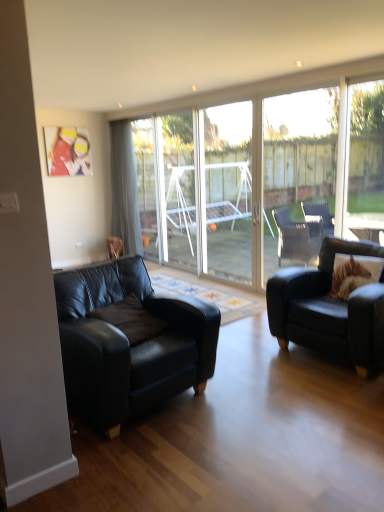
Find the location of `transparent glass door at center, which appears as the second window when viewed from the left`. transparent glass door at center, which appears as the second window when viewed from the left is located at coordinates (297, 172).

What do you see at coordinates (329, 309) in the screenshot?
I see `matte black armchair at right, which ranks as the 2th studio couch in left-to-right order` at bounding box center [329, 309].

This screenshot has width=384, height=512. What are the coordinates of `transparent glass screen door at center` in the screenshot? It's located at (213, 192).

The height and width of the screenshot is (512, 384). Describe the element at coordinates (354, 273) in the screenshot. I see `brown textured pillow at right` at that location.

Find the location of a particular element. The width and height of the screenshot is (384, 512). brown textured pillow at right is located at coordinates (354, 273).

Find the location of `transparent glass door at center, which is the first window from right to left`. transparent glass door at center, which is the first window from right to left is located at coordinates (297, 172).

From a real-world perspective, which is physically above, matte black armchair at right, which ranks as the 2th studio couch in left-to-right order, or transparent glass screen door at center?

transparent glass screen door at center is physically above.

Considering the relative sizes of matte black armchair at right, the 1th studio couch viewed from the right, and transparent glass screen door at center in the image provided, is matte black armchair at right, the 1th studio couch viewed from the right, shorter than transparent glass screen door at center?

Yes.

Looking at this image, which is correct: matte black armchair at right, the 1th studio couch viewed from the right, is inside transparent glass screen door at center, or outside of it?

matte black armchair at right, the 1th studio couch viewed from the right, is outside transparent glass screen door at center.

From the image's perspective, is matte black armchair at right, which ranks as the 2th studio couch in left-to-right order, above transparent glass screen door at center?

Actually, matte black armchair at right, which ranks as the 2th studio couch in left-to-right order, appears below transparent glass screen door at center in the image.

Which object is positioned more to the left, black leather couch at left, which appears as the second studio couch when viewed from the right, or transparent glass window at center, arranged as the first window when viewed from the back?

transparent glass window at center, arranged as the first window when viewed from the back, is more to the left.

Could you tell me if black leather couch at left, which is counted as the 1th studio couch, starting from the left, is turned towards transparent glass window at center, which is the 2th window from right to left?

No, black leather couch at left, which is counted as the 1th studio couch, starting from the left, is not facing towards transparent glass window at center, which is the 2th window from right to left.

Is black leather couch at left, which is counted as the 1th studio couch, starting from the left, far away from transparent glass window at center, which is the 2th window from right to left?

Yes, black leather couch at left, which is counted as the 1th studio couch, starting from the left, and transparent glass window at center, which is the 2th window from right to left, are quite far apart.

Image resolution: width=384 pixels, height=512 pixels. I want to click on the 1st studio couch counting from the right side of the transparent glass window at center, which is the 2th window from right to left, so click(129, 342).

Is point (152, 142) closer or farther from the camera than point (214, 172)?

Point (152, 142).

Can you tell me how much transparent glass window at center, which is counted as the 2th window, starting from the front, and transparent glass screen door at center differ in facing direction?

There is a 0.00215-degree angle between the facing directions of transparent glass window at center, which is counted as the 2th window, starting from the front, and transparent glass screen door at center.

From a real-world perspective, is transparent glass window at center, arranged as the first window when viewed from the back, above or below transparent glass screen door at center?

From a real-world perspective, transparent glass window at center, arranged as the first window when viewed from the back, is physically below transparent glass screen door at center.

Does transparent glass window at center, which is counted as the 2th window, starting from the front, appear on the right side of transparent glass screen door at center?

No, transparent glass window at center, which is counted as the 2th window, starting from the front, is not to the right of transparent glass screen door at center.

Is the surface of transparent glass screen door at center in direct contact with transparent glass window at center, placed as the 1th window when sorted from left to right?

transparent glass screen door at center is not next to transparent glass window at center, placed as the 1th window when sorted from left to right, and they're not touching.

Considering the sizes of transparent glass screen door at center and transparent glass window at center, which is counted as the 2th window, starting from the front, in the image, is transparent glass screen door at center bigger or smaller than transparent glass window at center, which is counted as the 2th window, starting from the front,?

Clearly, transparent glass screen door at center is larger in size than transparent glass window at center, which is counted as the 2th window, starting from the front.

Is transparent glass screen door at center spatially inside transparent glass window at center, arranged as the first window when viewed from the back, or outside of it?

transparent glass screen door at center is not inside transparent glass window at center, arranged as the first window when viewed from the back, it's outside.

How far apart are transparent glass window at center, which is the 2th window from right to left, and transparent glass door at center, the 1th window positioned from the front?

transparent glass window at center, which is the 2th window from right to left, and transparent glass door at center, the 1th window positioned from the front, are 6.29 feet apart from each other.

Is transparent glass window at center, which is the 2th window from right to left, wider or thinner than transparent glass door at center, the second window when ordered from back to front?

Considering their sizes, transparent glass window at center, which is the 2th window from right to left, looks slimmer than transparent glass door at center, the second window when ordered from back to front.

Does transparent glass window at center, which is the 2th window from right to left, appear on the left side of transparent glass door at center, the second window when ordered from back to front?

Indeed, transparent glass window at center, which is the 2th window from right to left, is positioned on the left side of transparent glass door at center, the second window when ordered from back to front.

Between gray fabric curtain at left and brown textured pillow at right, which one is positioned behind?

Positioned behind is gray fabric curtain at left.

From the picture: From a real-world perspective, is gray fabric curtain at left physically above brown textured pillow at right?

Yes.

Considering the sizes of gray fabric curtain at left and brown textured pillow at right in the image, is gray fabric curtain at left taller or shorter than brown textured pillow at right?

Considering their sizes, gray fabric curtain at left has more height than brown textured pillow at right.

Between gray fabric curtain at left and brown textured pillow at right, which one has smaller width?

brown textured pillow at right is thinner.

Who is smaller, transparent glass door at center or black leather couch at left, which appears as the second studio couch when viewed from the right?

transparent glass door at center is smaller.

From a real-world perspective, who is located higher, transparent glass door at center or black leather couch at left, which appears as the second studio couch when viewed from the right?

In real-world perspective, transparent glass door at center is above.

Where is `glass door on the right of the black leather couch at left, which appears as the second studio couch when viewed from the right`? This screenshot has width=384, height=512. glass door on the right of the black leather couch at left, which appears as the second studio couch when viewed from the right is located at coordinates (177, 189).

Is transparent glass door at center to the right of black leather couch at left, which is counted as the 1th studio couch, starting from the left, from the viewer's perspective?

Indeed, transparent glass door at center is positioned on the right side of black leather couch at left, which is counted as the 1th studio couch, starting from the left.

Where is `screen door on the left of matte black armchair at right, which ranks as the 2th studio couch in left-to-right order`? This screenshot has height=512, width=384. screen door on the left of matte black armchair at right, which ranks as the 2th studio couch in left-to-right order is located at coordinates (213, 192).

Starting from the transparent glass window at center, placed as the 1th window when sorted from left to right, which studio couch is the 2nd one in front? Please provide its 2D coordinates.

[(129, 342)]

In the scene shown: Estimate the real-world distances between objects in this image. Which object is closer to transparent glass screen door at center, transparent glass door at center, which is the first window from right to left, or transparent glass window at center, which is the 2th window from right to left?

The object closer to transparent glass screen door at center is transparent glass door at center, which is the first window from right to left.

Which object lies further to the anchor point transparent glass door at center, gray fabric curtain at left or matte black armchair at right, the 1th studio couch viewed from the right?

matte black armchair at right, the 1th studio couch viewed from the right, is positioned further to the anchor transparent glass door at center.

Considering their positions, is black leather couch at left, which appears as the second studio couch when viewed from the right, positioned further to matte black armchair at right, the 1th studio couch viewed from the right, than transparent glass window at center, which is counted as the 2th window, starting from the front?

transparent glass window at center, which is counted as the 2th window, starting from the front, is positioned further to the anchor matte black armchair at right, the 1th studio couch viewed from the right.

When comparing their distances from matte black armchair at right, which ranks as the 2th studio couch in left-to-right order, does brown textured pillow at right or transparent glass door at center, which is the first window from right to left, seem further?

transparent glass door at center, which is the first window from right to left, is positioned further to the anchor matte black armchair at right, which ranks as the 2th studio couch in left-to-right order.

Looking at this image, looking at the image, which one is located further to transparent glass door at center, which is the first window from right to left, matte black armchair at right, which ranks as the 2th studio couch in left-to-right order, or transparent glass window at center, which is counted as the 2th window, starting from the front?

The object further to transparent glass door at center, which is the first window from right to left, is matte black armchair at right, which ranks as the 2th studio couch in left-to-right order.

Estimate the real-world distances between objects in this image. Which object is further from transparent glass screen door at center, matte black armchair at right, which ranks as the 2th studio couch in left-to-right order, or gray fabric curtain at left?

The object further to transparent glass screen door at center is matte black armchair at right, which ranks as the 2th studio couch in left-to-right order.

Based on their spatial positions, is transparent glass door at center or transparent glass window at center, which is the 2th window from right to left, closer to matte black armchair at right, which ranks as the 2th studio couch in left-to-right order?

transparent glass door at center is positioned closer to the anchor matte black armchair at right, which ranks as the 2th studio couch in left-to-right order.

When comparing their distances from matte black armchair at right, the 1th studio couch viewed from the right, does brown textured pillow at right or black leather couch at left, which is counted as the 1th studio couch, starting from the left, seem further?

black leather couch at left, which is counted as the 1th studio couch, starting from the left.

Locate an element on the screen. pillow located between matte black armchair at right, which ranks as the 2th studio couch in left-to-right order, and transparent glass screen door at center in the depth direction is located at coordinates (354, 273).

Find the location of a particular element. This screenshot has height=512, width=384. glass door located between brown textured pillow at right and gray fabric curtain at left in the depth direction is located at coordinates (177, 189).

Locate an element on the screen. The image size is (384, 512). glass door located between transparent glass screen door at center and transparent glass window at center, which is the 2th window from right to left, in the depth direction is located at coordinates (177, 189).

At what (x,y) coordinates should I click in order to perform the action: click on window between transparent glass door at center, which appears as the second window when viewed from the left, and gray fabric curtain at left in the front-back direction. Please return your answer as a coordinate pair (x, y). Looking at the image, I should click on (147, 185).